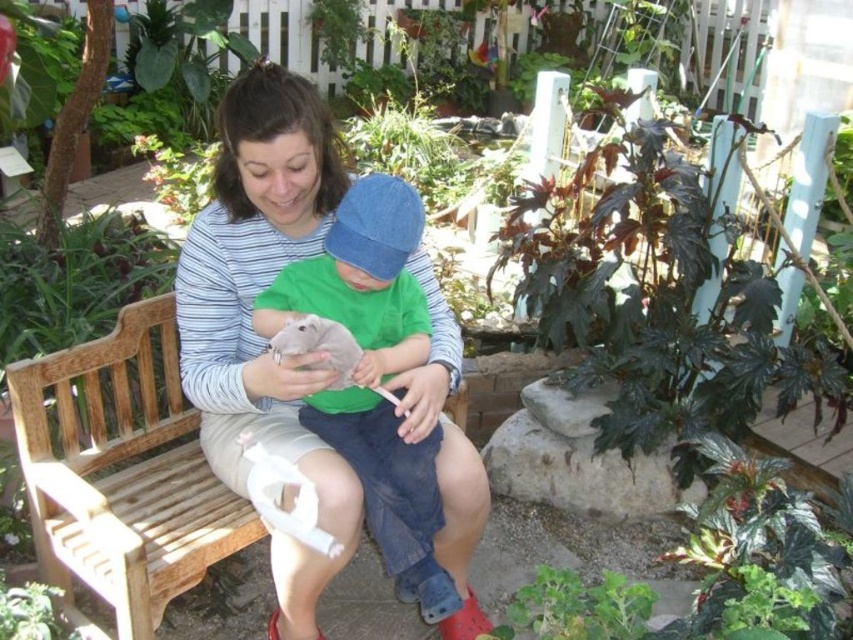
Question: Can you confirm if green fuzzy plant at lower center is positioned to the left of green leafy plant at lower left?

Choices:
 (A) no
 (B) yes

Answer: (A)

Question: Does wooden bench at center lie behind green leafy plant at upper center?

Choices:
 (A) no
 (B) yes

Answer: (A)

Question: Which object is positioned farthest from the green fuzzy plant at lower center?

Choices:
 (A) wooden bench at center
 (B) green leafy plant at upper center

Answer: (B)

Question: Considering the real-world distances, which object is closest to the green leafy plant at lower left?

Choices:
 (A) denim cap at center
 (B) green fuzzy plant at lower center
 (C) green leafy plant at upper center
 (D) wooden bench at center

Answer: (D)

Question: Which is nearer to the green leafy plant at upper center?

Choices:
 (A) green fuzzy plant at lower center
 (B) denim cap at center

Answer: (B)

Question: Is wooden bench at center to the left of green leafy plant at upper center from the viewer's perspective?

Choices:
 (A) no
 (B) yes

Answer: (A)